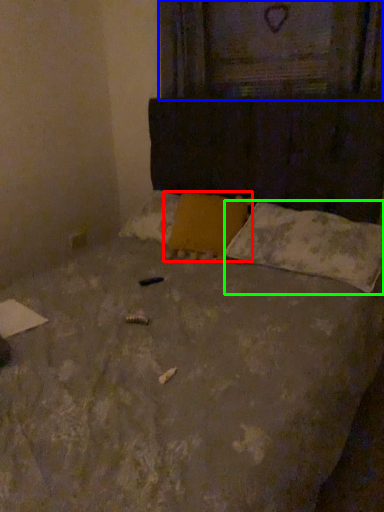
Question: Based on their relative distances, which object is farther from pillow (highlighted by a red box)? Choose from window frame (highlighted by a blue box) and pillow (highlighted by a green box).

Choices:
 (A) window frame
 (B) pillow

Answer: (A)